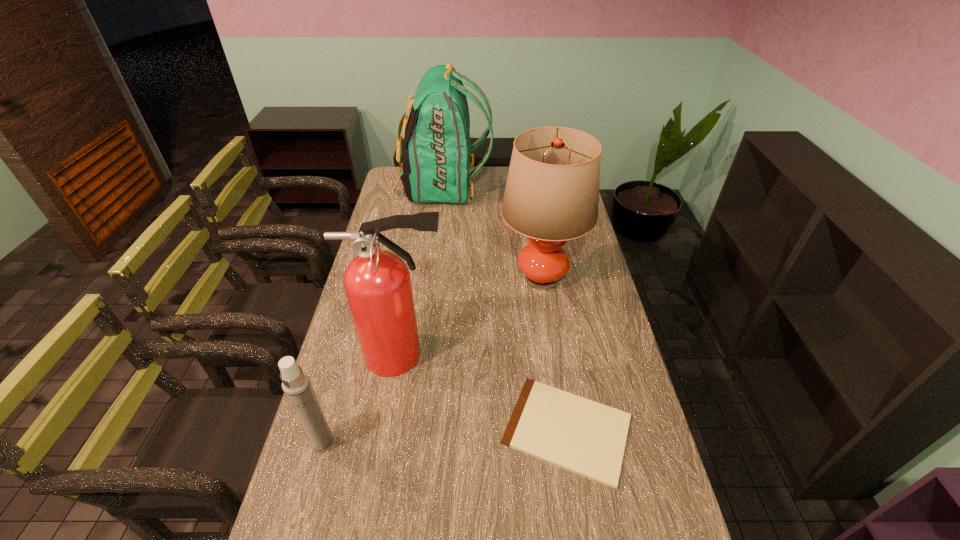
Image resolution: width=960 pixels, height=540 pixels. I want to click on vacant region between the fourth nearest object and the fire extinguisher, so click(x=472, y=317).

Where is `free space that is in between the lamp and the second shortest object`? The width and height of the screenshot is (960, 540). free space that is in between the lamp and the second shortest object is located at coordinates (432, 361).

Identify the location of free space that is in between the second farthest object and the farthest object. The height and width of the screenshot is (540, 960). (492, 234).

This screenshot has width=960, height=540. I want to click on free area in between the clipboard and the lamp, so click(x=554, y=354).

Where is `free space between the fire extinguisher and the clipboard`? This screenshot has height=540, width=960. free space between the fire extinguisher and the clipboard is located at coordinates (485, 392).

Identify the location of empty space that is in between the shortest object and the fire extinguisher. (485, 392).

Locate an element on the screen. object that stands as the fourth closest to the farthest object is located at coordinates (296, 385).

I want to click on object that stands as the second closest to the lamp, so click(436, 160).

Locate an element on the screen. This screenshot has width=960, height=540. vacant space that satisfies the following two spatial constraints: 1. on the back of the farthest object; 2. on the back side of the fourth nearest object is located at coordinates (433, 279).

Locate an element on the screen. This screenshot has height=540, width=960. vacant point that satisfies the following two spatial constraints: 1. on the back side of the lamp; 2. on the back of the farthest object is located at coordinates (527, 190).